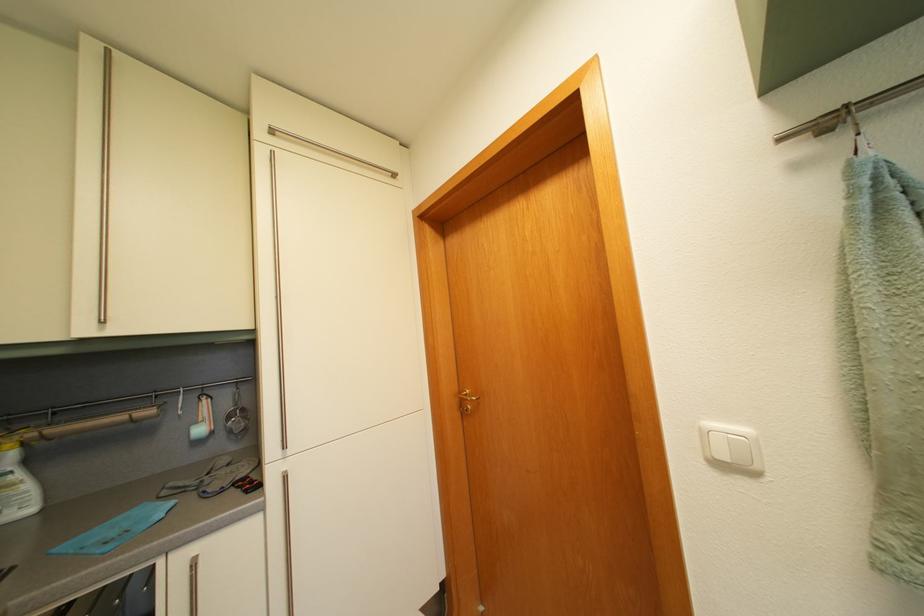
Locate an element on the screen. This screenshot has height=616, width=924. golden door handle is located at coordinates (467, 399).